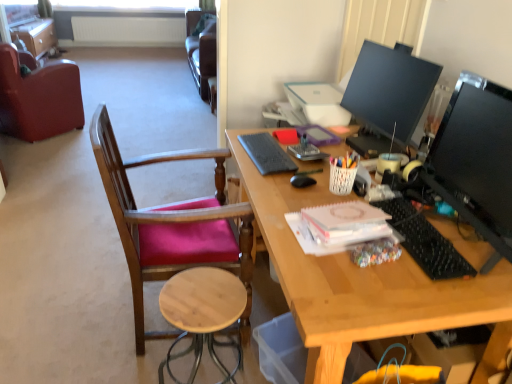
Identify the location of vacant area on top of gray matte keyboard at center, the first notepad in the top-to-bottom sequence (from a real-world perspective). (266, 148).